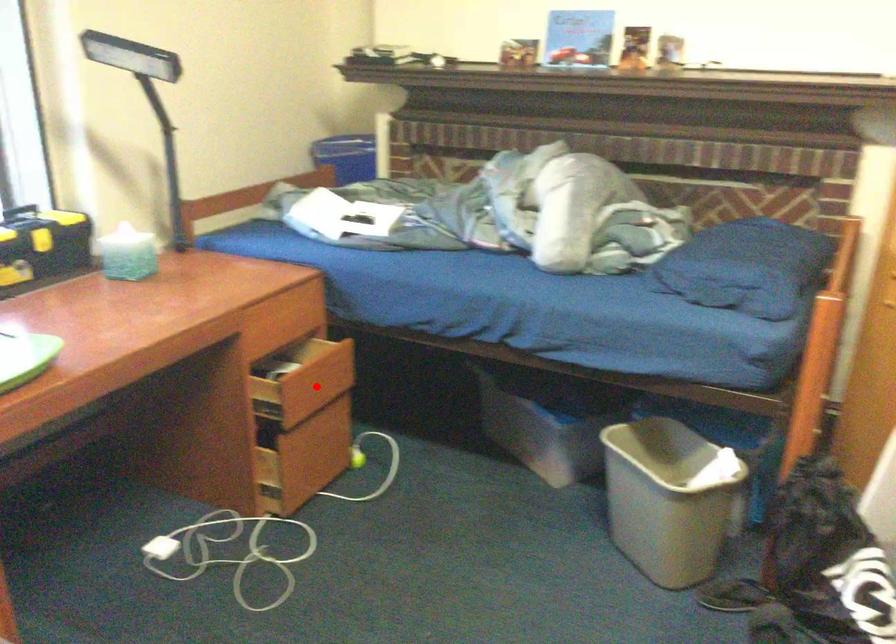
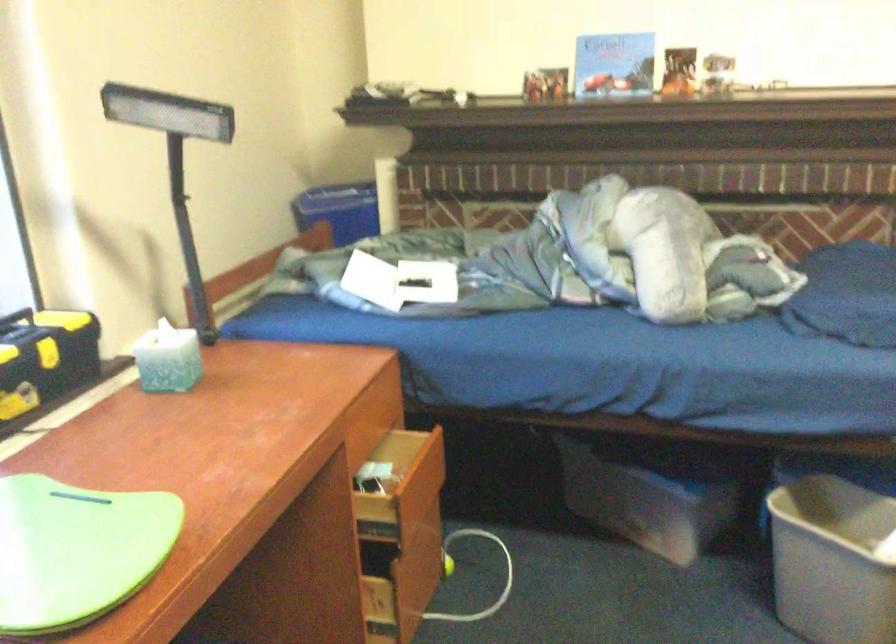
Question: I am providing you with two images of the same scene from different viewpoints. Given a red point in image1, look at the same physical point in image2. Is it:

Choices:
 (A) Closer to the viewpoint
 (B) Farther from the viewpoint

Answer: (A)